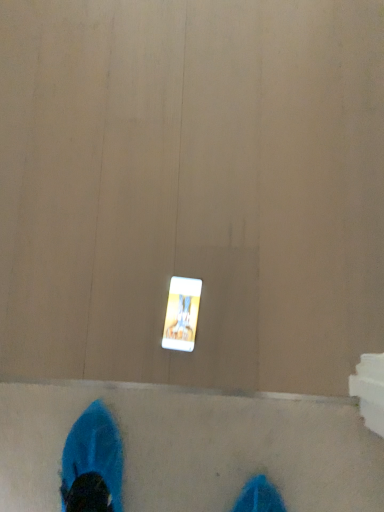
Question: Should I look upward or downward to see white glossy mobile phone at center?

Choices:
 (A) up
 (B) down

Answer: (B)